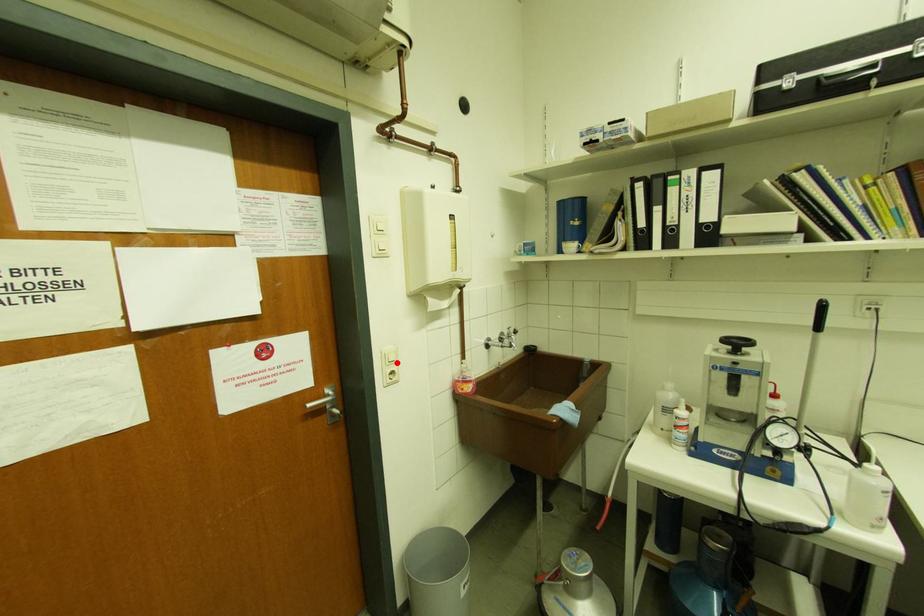
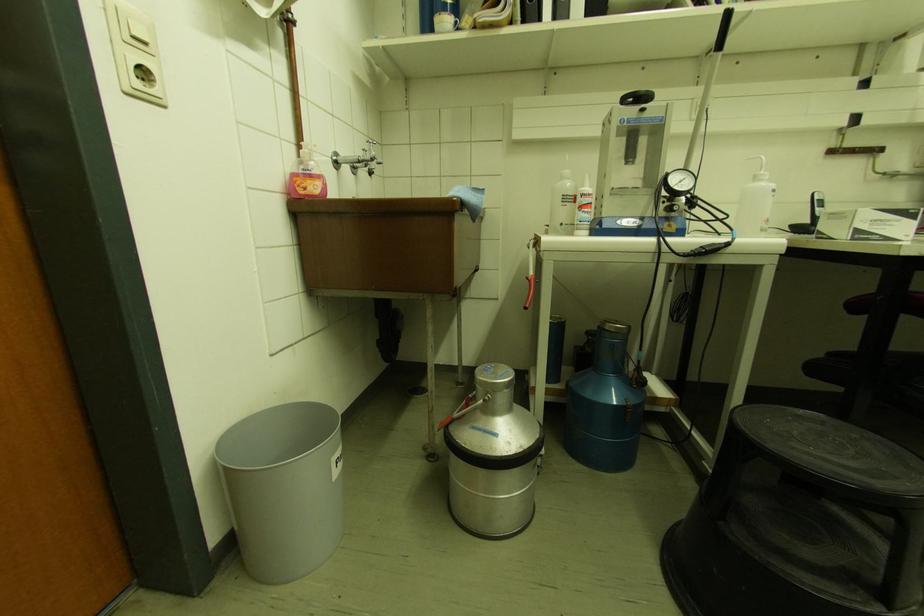
Where in the second image is the point corresponding to the highlighted location from the first image?

(149, 45)